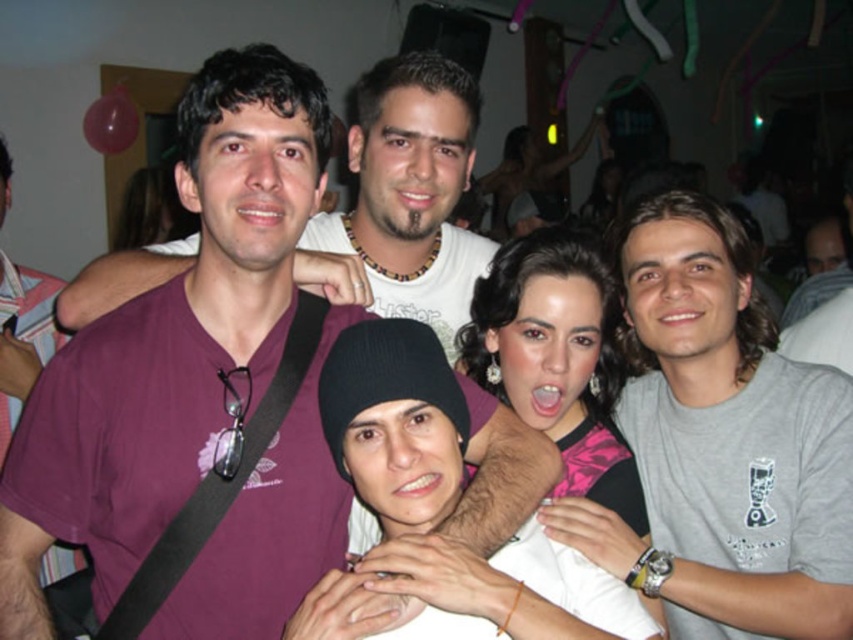
Question: Which object is farther from the camera taking this photo?

Choices:
 (A) gray cotton t-shirt at right
 (B) purple matte t-shirt at center

Answer: (A)

Question: Among these objects, which one is farthest from the camera?

Choices:
 (A) gray cotton t-shirt at right
 (B) purple matte t-shirt at center

Answer: (A)

Question: Where is purple matte t-shirt at center located in relation to gray cotton t-shirt at right in the image?

Choices:
 (A) left
 (B) right

Answer: (A)

Question: Is purple matte t-shirt at center in front of gray cotton t-shirt at right?

Choices:
 (A) no
 (B) yes

Answer: (B)

Question: Is purple matte t-shirt at center smaller than gray cotton t-shirt at right?

Choices:
 (A) no
 (B) yes

Answer: (B)